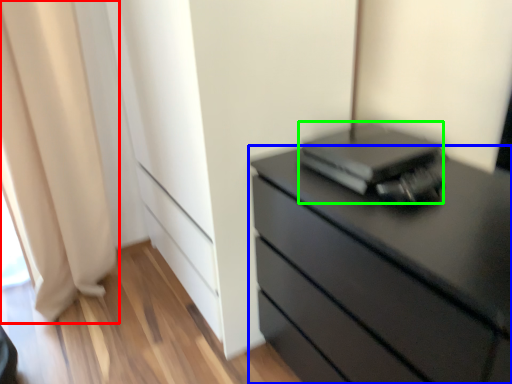
Question: Estimate the real-world distances between objects in this image. Which object is closer to curtain (highlighted by a red box), chest of drawers (highlighted by a blue box) or computer (highlighted by a green box)?

Choices:
 (A) chest of drawers
 (B) computer

Answer: (B)